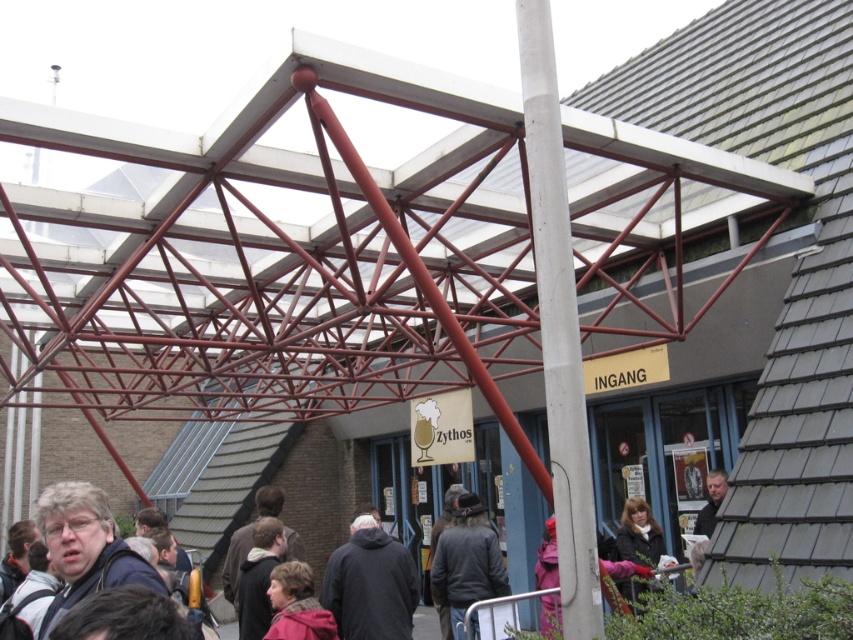
Measure the distance between point (358,538) and camera.

Point (358,538) and camera are 9.27 meters apart from each other.

Which is in front, point (407, 576) or point (300, 586)?

Positioned in front is point (300, 586).

At what (x,y) coordinates should I click in order to perform the action: click on dark gray hoodie at center. Please return your answer as a coordinate pair (x, y). This screenshot has height=640, width=853. Looking at the image, I should click on (370, 584).

Does dark gray hoodie at center have a smaller size compared to dark brown leather jacket at center?

Yes.

Which is behind, point (350, 612) or point (469, 566)?

Point (469, 566)

Find the location of `dark gray hoodie at center`. dark gray hoodie at center is located at coordinates (370, 584).

Which is below, dark brown leather jacket at center or pink fabric at center?

dark brown leather jacket at center is lower down.

Is dark brown leather jacket at center positioned at the back of pink fabric at center?

Yes, dark brown leather jacket at center is further from the viewer.

Is point (474, 621) in front of point (299, 632)?

That is False.

Identify the location of dark brown leather jacket at center. This screenshot has width=853, height=640. (467, 561).